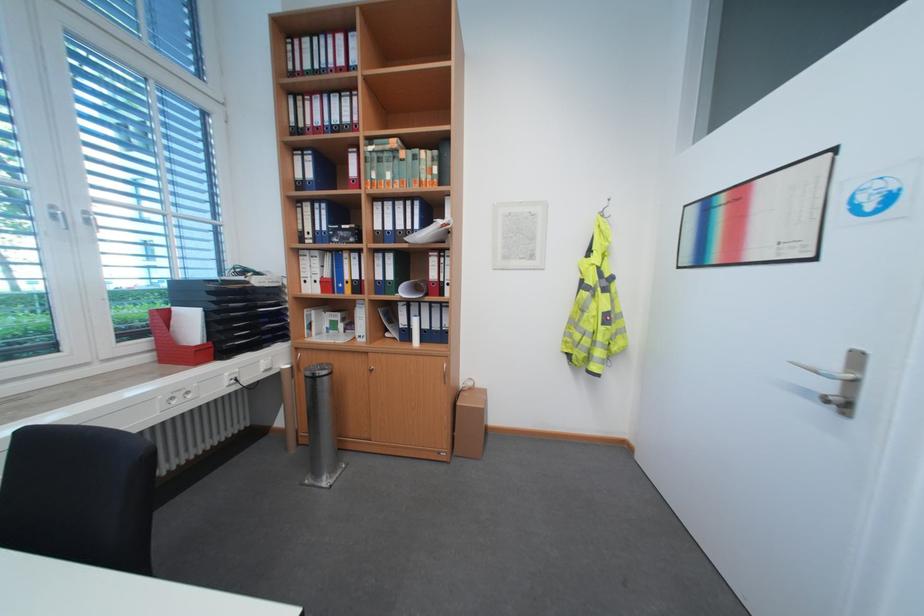
Locate an element on the screen. The height and width of the screenshot is (616, 924). rolled white paper is located at coordinates (431, 233).